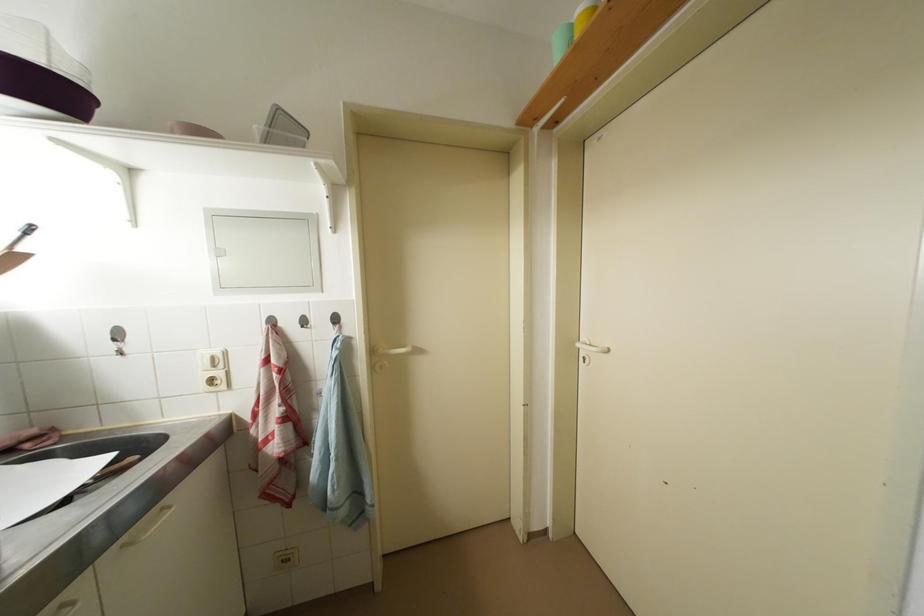
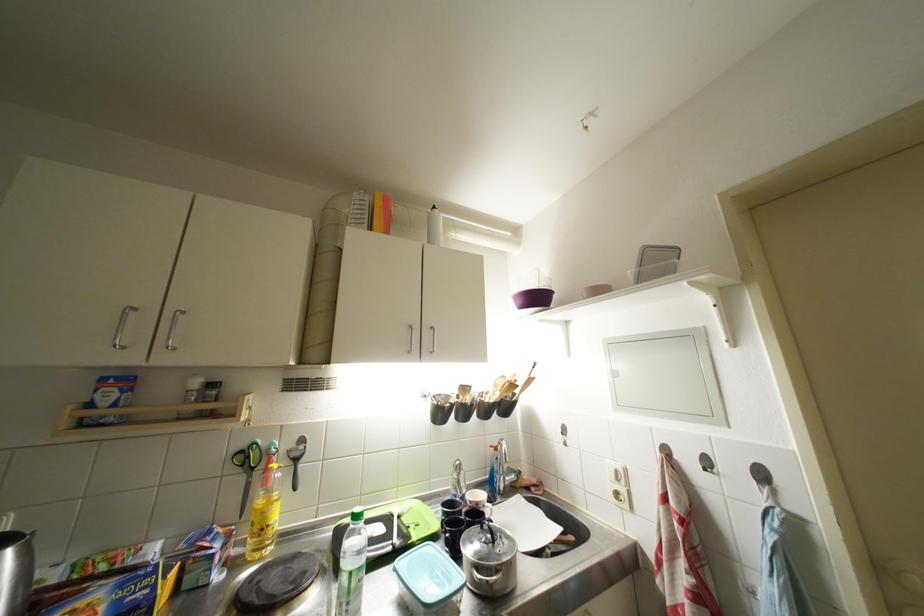
In the second image, find the point that corresponds to (310,326) in the first image.

(714, 467)